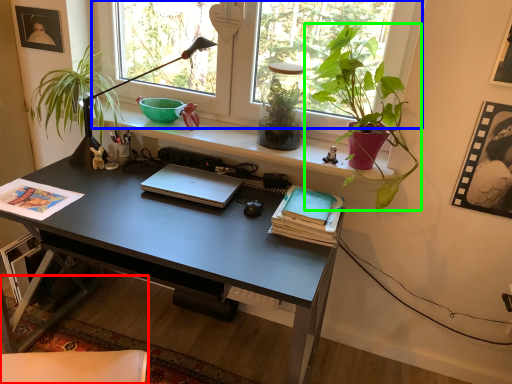
Question: Estimate the real-world distances between objects in this image. Which object is closer to swivel chair (highlighted by a red box), window (highlighted by a blue box) or houseplant (highlighted by a green box)?

Choices:
 (A) window
 (B) houseplant

Answer: (B)